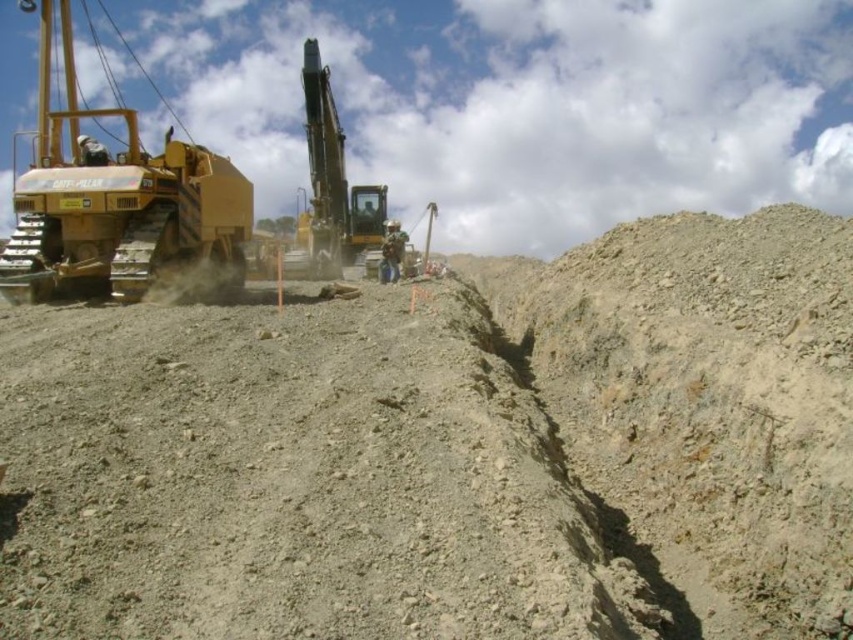
You are a safety inspector at the construction site. You need to ensure that the matte yellow bulldozer at left and the camouflage fabric construction worker at center are visible to each other for safety. Given their sizes, which one is more likely to block the other from view?

The matte yellow bulldozer at left is bigger than the camouflage fabric construction worker at center, so the bulldozer could potentially block the worker from view if positioned between them.

You are a safety inspector standing at the edge of the trench. You need to check both the yellow metallic excavator at center and the camouflage fabric construction worker at center. Which one should you check first based on their positions?

You should check the yellow metallic excavator at center first because it is closer to you than the camouflage fabric construction worker at center, so it is safer to address the closer object first.

You are a safety inspector standing at the camera position. You need to inspect the yellow metallic excavator at center. Can you walk directly to it from your current position without needing to go around any obstacles?

The yellow metallic excavator at center is 97.87 meters from camera, so yes, you can walk directly to it from your current position without needing to go around any obstacles since there are no mentioned obstacles in the scene description.